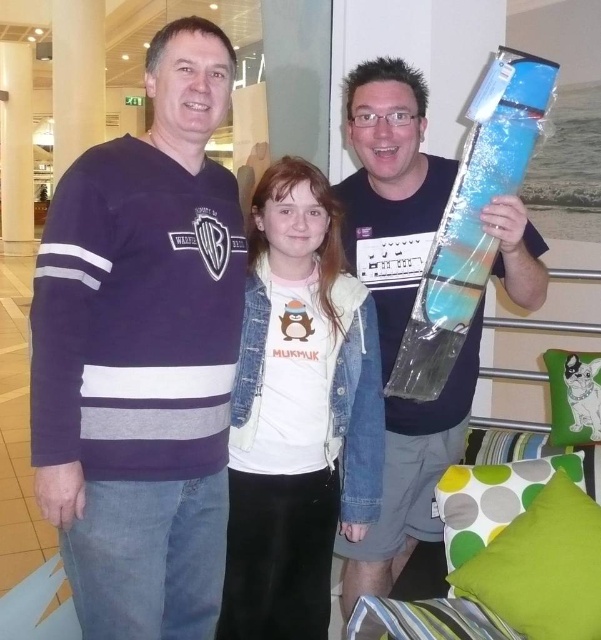
Question: Is purple jersey at left smaller than blue plastic guitar at center?

Choices:
 (A) no
 (B) yes

Answer: (B)

Question: Which point is farther to the camera?

Choices:
 (A) (203, 26)
 (B) (486, 218)
 (C) (353, 484)

Answer: (C)

Question: Is white cotton t-shirt at center to the left of blue plastic guitar at center from the viewer's perspective?

Choices:
 (A) yes
 (B) no

Answer: (A)

Question: Which of the following is the farthest from the observer?

Choices:
 (A) (371, 198)
 (B) (81, 278)
 (C) (240, 392)

Answer: (A)

Question: Can you confirm if purple jersey at left is thinner than blue plastic guitar at center?

Choices:
 (A) no
 (B) yes

Answer: (B)

Question: Among these points, which one is farthest from the camera?

Choices:
 (A) (255, 588)
 (B) (419, 90)
 (C) (139, 568)

Answer: (A)